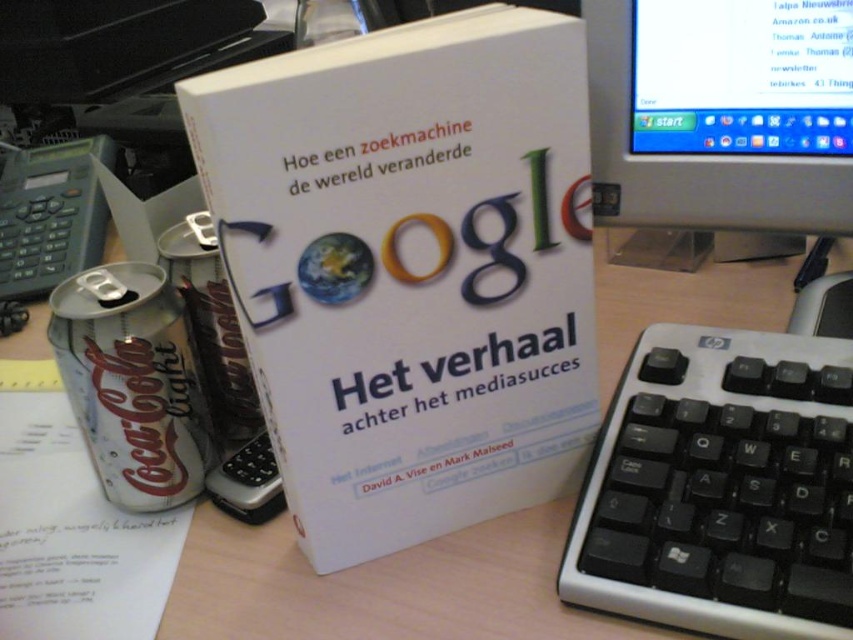
Question: Which object is positioned closest to the white plastic keyboard at right?

Choices:
 (A) matte plastic monitor at upper right
 (B) white plastic computer desk at center
 (C) silver metallic can at lower left

Answer: (B)

Question: Which point is farther to the camera?

Choices:
 (A) white plastic computer desk at center
 (B) matte plastic monitor at upper right

Answer: (B)

Question: Which point is farther from the camera taking this photo?

Choices:
 (A) (590, 588)
 (B) (341, 196)
 (C) (134, 317)
 (D) (398, 604)

Answer: (C)

Question: Does white plastic computer desk at center appear on the right side of matte plastic monitor at upper right?

Choices:
 (A) no
 (B) yes

Answer: (A)

Question: Does white paper book at center have a smaller size compared to white plastic computer desk at center?

Choices:
 (A) yes
 (B) no

Answer: (A)

Question: Can you confirm if white paper book at center is smaller than matte plastic monitor at upper right?

Choices:
 (A) yes
 (B) no

Answer: (B)